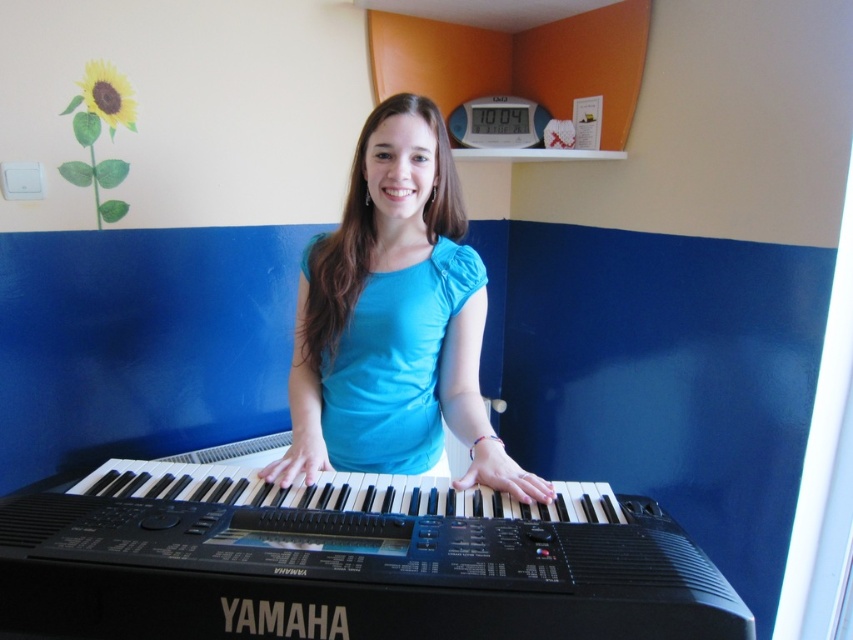
Is point (550, 541) closer to viewer compared to point (444, 291)?

Yes, it is in front of point (444, 291).

Does black plastic piano at center have a smaller size compared to blue fabric shirt at center?

Yes, black plastic piano at center is smaller than blue fabric shirt at center.

The width and height of the screenshot is (853, 640). What do you see at coordinates (347, 563) in the screenshot?
I see `black plastic piano at center` at bounding box center [347, 563].

Identify the location of black plastic piano at center. This screenshot has width=853, height=640. pos(347,563).